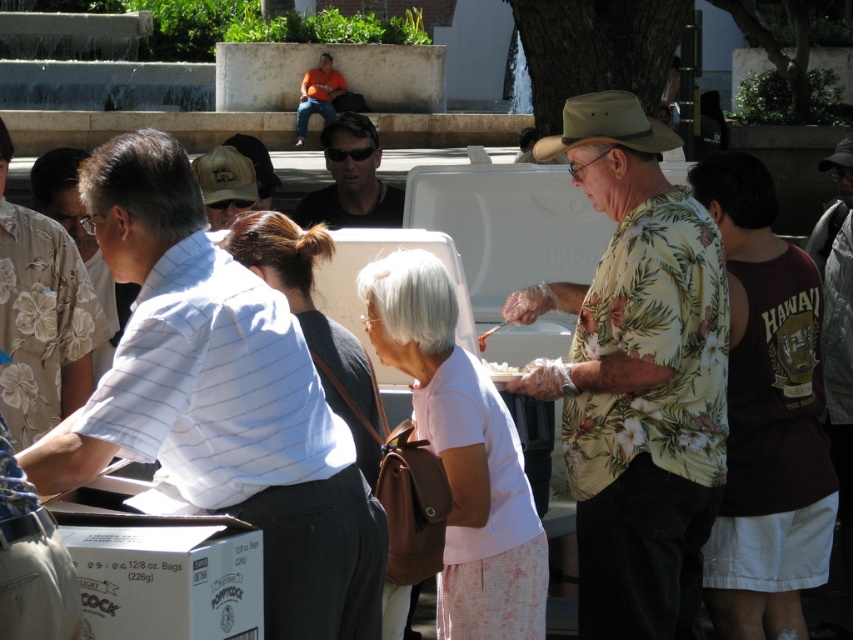
Question: Estimate the real-world distances between objects in this image. Which object is closer to the maroon fabric shirt at right?

Choices:
 (A) khaki fabric cap at center
 (B) matte black shirt at center
 (C) white matte plate at center
 (D) light pink fabric shirt at center

Answer: (C)

Question: Observing the image, what is the correct spatial positioning of maroon fabric shirt at right in reference to white fabric at center?

Choices:
 (A) left
 (B) right

Answer: (B)

Question: Which point appears closest to the camera in this image?

Choices:
 (A) (726, 474)
 (B) (222, 394)

Answer: (B)

Question: Does maroon fabric shirt at right appear on the right side of light pink fabric shirt at center?

Choices:
 (A) no
 (B) yes

Answer: (B)

Question: Which is farther from the orange t-shirt at upper center?

Choices:
 (A) floral print shirt at center
 (B) white matte plate at center

Answer: (B)

Question: Does floral print shirt at center have a lesser width compared to khaki fabric cap at center?

Choices:
 (A) no
 (B) yes

Answer: (B)